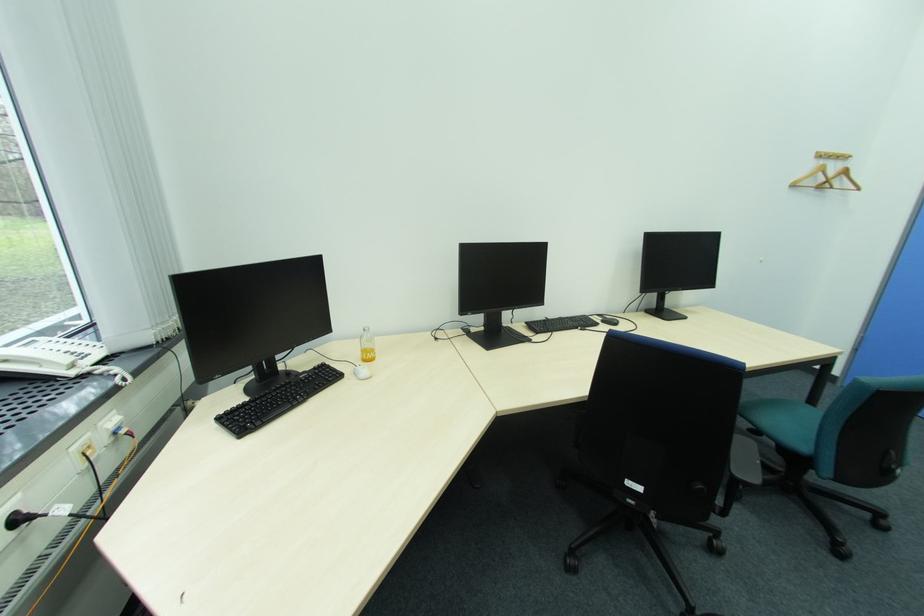
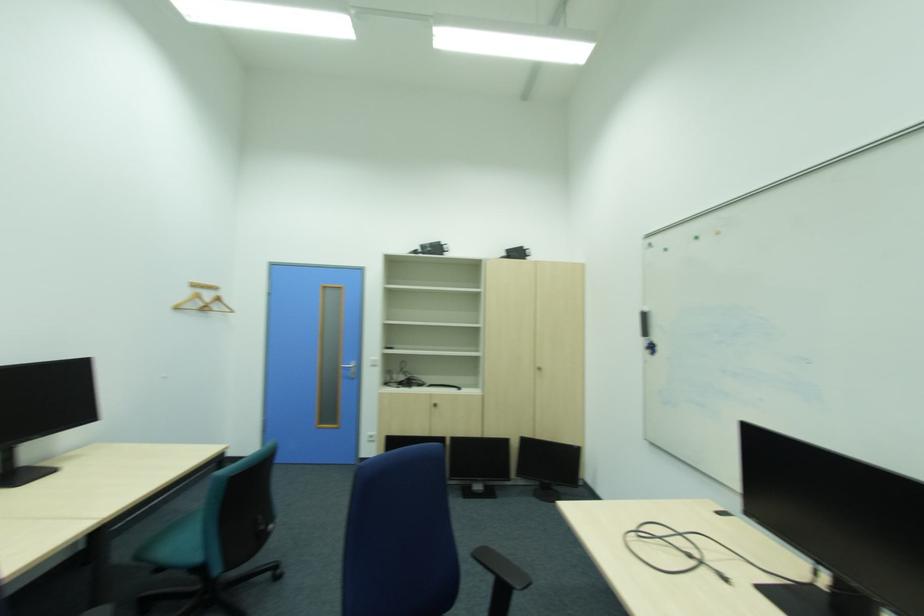
Question: The images are taken continuously from a first-person perspective. In which direction is your viewpoint rotating?

Choices:
 (A) Left
 (B) Right
 (C) Up
 (D) Down

Answer: (B)